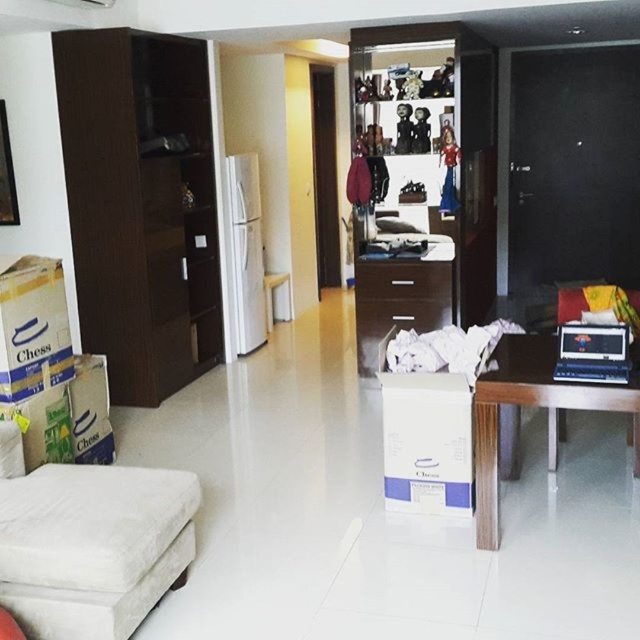
Does point (204, 100) come farther from viewer compared to point (61, 483)?

That is True.

From the picture: Does dark wood cabinet at left appear on the right side of white fabric ottoman at lower left?

In fact, dark wood cabinet at left is to the left of white fabric ottoman at lower left.

Which is behind, point (179, 179) or point (26, 532)?

Point (179, 179)

Where is `dark wood cabinet at left`? dark wood cabinet at left is located at coordinates (140, 205).

Can you confirm if dark wood cabinet at left is bigger than wooden wardrobe at center?

No.

Who is positioned more to the left, dark wood cabinet at left or wooden wardrobe at center?

dark wood cabinet at left

You are a GUI agent. You are given a task and a screenshot of the screen. Output one action in this format:
    pyautogui.click(x=<x>, y=<y>)
    Task: Click on the dark wood cabinet at left
    The height and width of the screenshot is (640, 640).
    Given the screenshot: What is the action you would take?
    pyautogui.click(x=140, y=205)

Is wooden wardrobe at center bigger than white fabric ottoman at lower left?

Yes.

Does wooden wardrobe at center come behind white fabric ottoman at lower left?

Yes, wooden wardrobe at center is behind white fabric ottoman at lower left.

Where is `wooden wardrobe at center`? The width and height of the screenshot is (640, 640). wooden wardrobe at center is located at coordinates (424, 177).